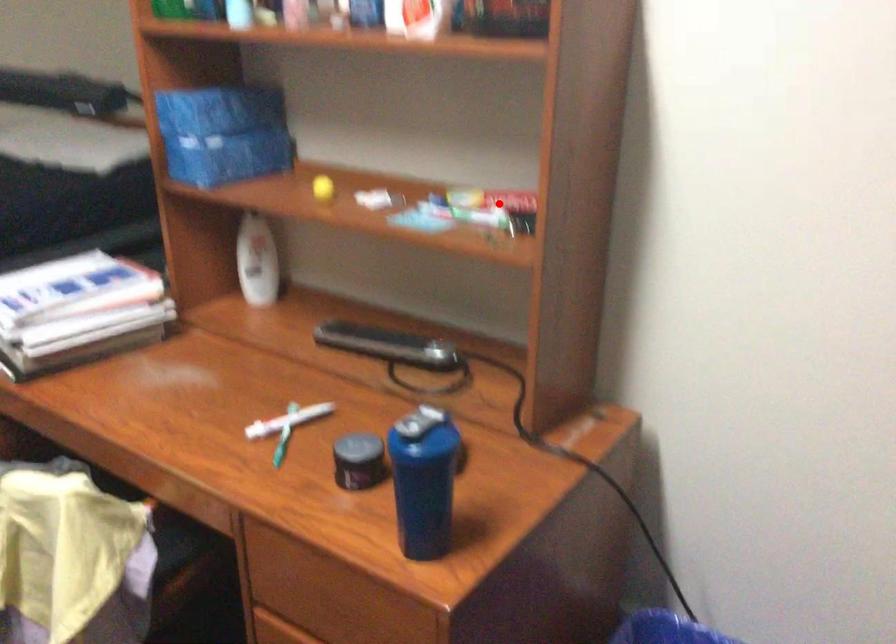
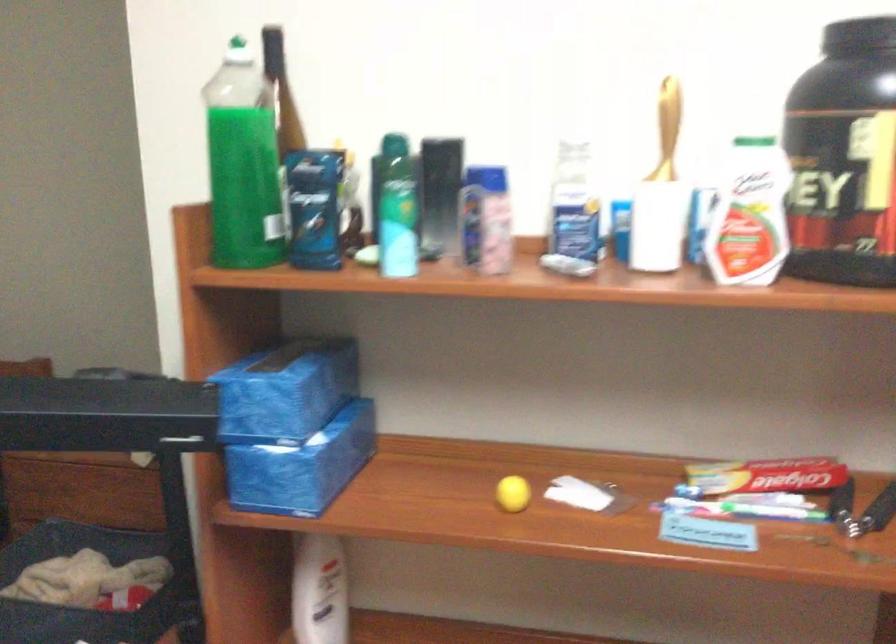
Question: A red point is marked in image1. In image2, is the corresponding 3D point closer to the camera or farther? Reply with the corresponding letter.

Choices:
 (A) The corresponding 3D point is closer.
 (B) The corresponding 3D point is farther.

Answer: (A)